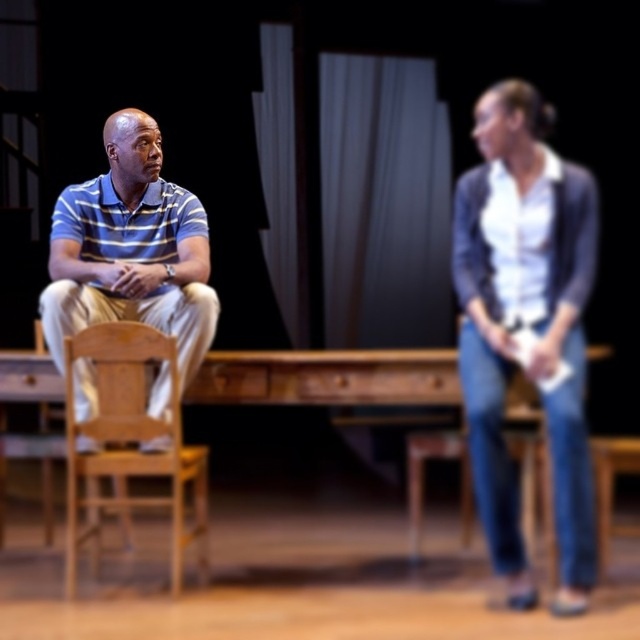
Between wooden chair at left and white fabric curtain at center, which one appears on the left side from the viewer's perspective?

From the viewer's perspective, wooden chair at left appears more on the left side.

Is wooden chair at left positioned before white fabric curtain at center?

Yes, wooden chair at left is closer to the viewer.

What do you see at coordinates (131, 442) in the screenshot? The width and height of the screenshot is (640, 640). I see `wooden chair at left` at bounding box center [131, 442].

Where is `wooden chair at left`? Image resolution: width=640 pixels, height=640 pixels. wooden chair at left is located at coordinates (131, 442).

Identify the location of white cotton shirt at right. (525, 324).

Between white cotton shirt at right and striped polo shirt at left, which one is positioned lower?

white cotton shirt at right is lower down.

Is point (579, 284) positioned behind point (161, 166)?

No, (579, 284) is in front of (161, 166).

I want to click on white cotton shirt at right, so click(x=525, y=324).

This screenshot has width=640, height=640. What are the coordinates of `white cotton shirt at right` in the screenshot? It's located at (525, 324).

Between white cotton shirt at right and white fabric curtain at center, which one appears on the left side from the viewer's perspective?

white fabric curtain at center

Which is in front, point (566, 300) or point (268, 33)?

Point (566, 300)

I want to click on white cotton shirt at right, so click(525, 324).